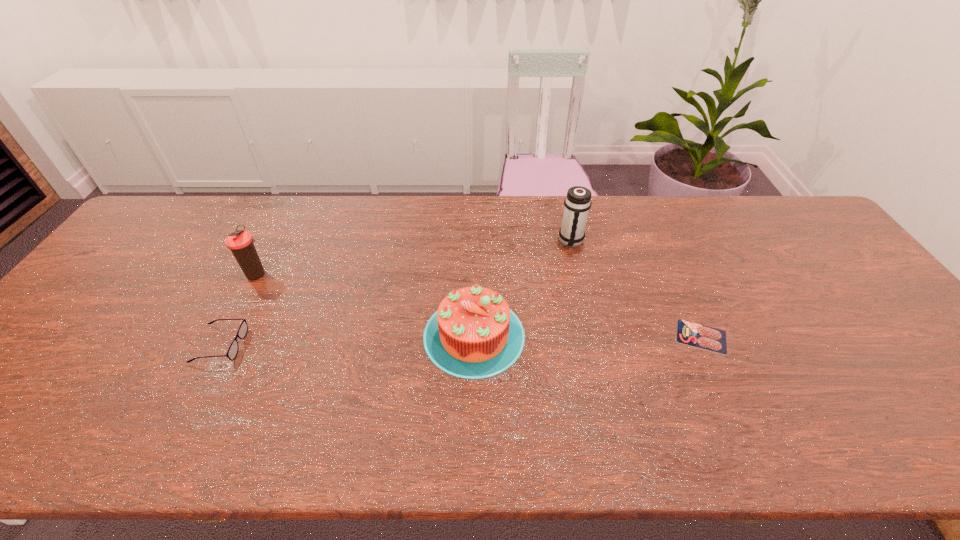
What are the coordinates of `free space that satisfies the following two spatial constraints: 1. on the front side of the rightmost object; 2. on the front-facing side of the second shortest object` in the screenshot? It's located at (705, 345).